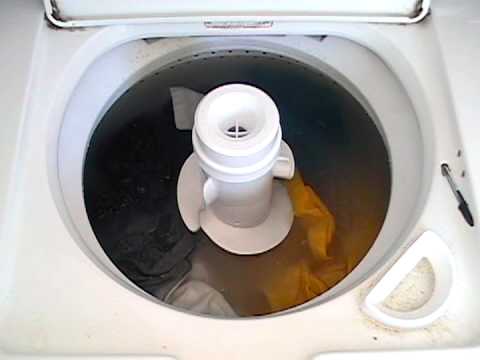
Find the location of a particular element. metal tub of washer is located at coordinates (x=225, y=54).